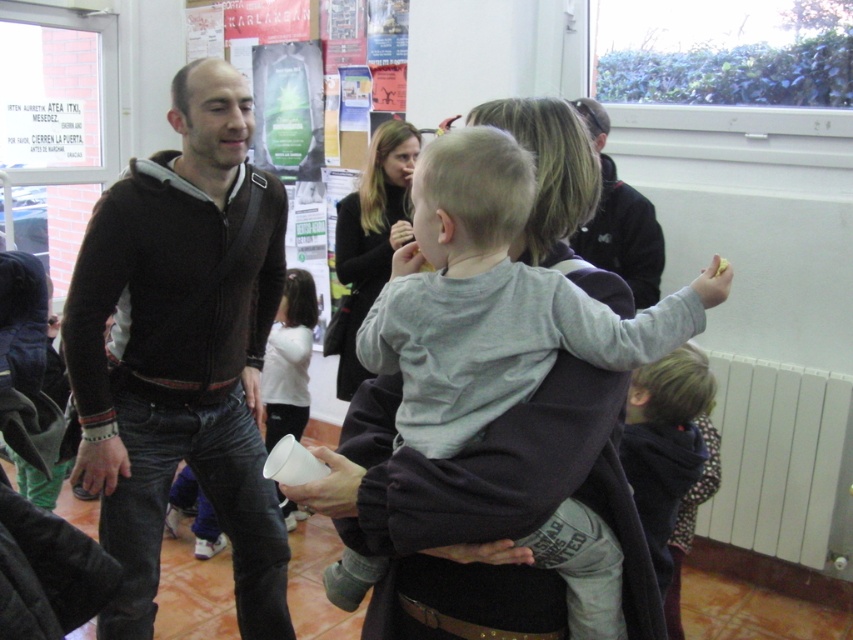
Who is more distant from viewer, (x=618, y=317) or (x=635, y=237)?

The point (x=635, y=237) is more distant.

This screenshot has height=640, width=853. What are the coordinates of `gray cotton shirt at center` in the screenshot? It's located at (494, 301).

Which is in front, point (577, 524) or point (602, 163)?

Point (577, 524) is in front.

At what (x,y) coordinates should I click in order to perform the action: click on gray cotton shirt at center. Please return your answer as a coordinate pair (x, y). Looking at the image, I should click on point(494,301).

Can you confirm if gray cotton shirt at center is thinner than light brown hair at lower right?

No.

Does point (628, 356) come behind point (671, 401)?

No, (628, 356) is closer to viewer.

You are a GUI agent. You are given a task and a screenshot of the screen. Output one action in this format:
    pyautogui.click(x=<x>, y=<y>)
    Task: Click on the gray cotton shirt at center
    This screenshot has height=640, width=853.
    Given the screenshot: What is the action you would take?
    pyautogui.click(x=494, y=301)

Who is positioned more to the left, black zip-up hoodie at left or light brown hair at lower right?

Positioned to the left is black zip-up hoodie at left.

I want to click on black zip-up hoodie at left, so click(x=183, y=349).